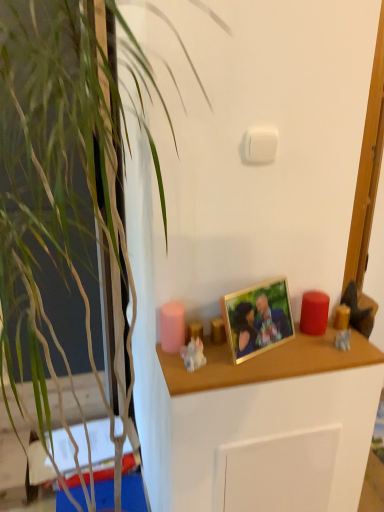
This screenshot has height=512, width=384. Find the location of `vacant area located to the right-hand side of pink matte candle at center, positioned as the 1th candle in left-to-right order`. vacant area located to the right-hand side of pink matte candle at center, positioned as the 1th candle in left-to-right order is located at coordinates (248, 355).